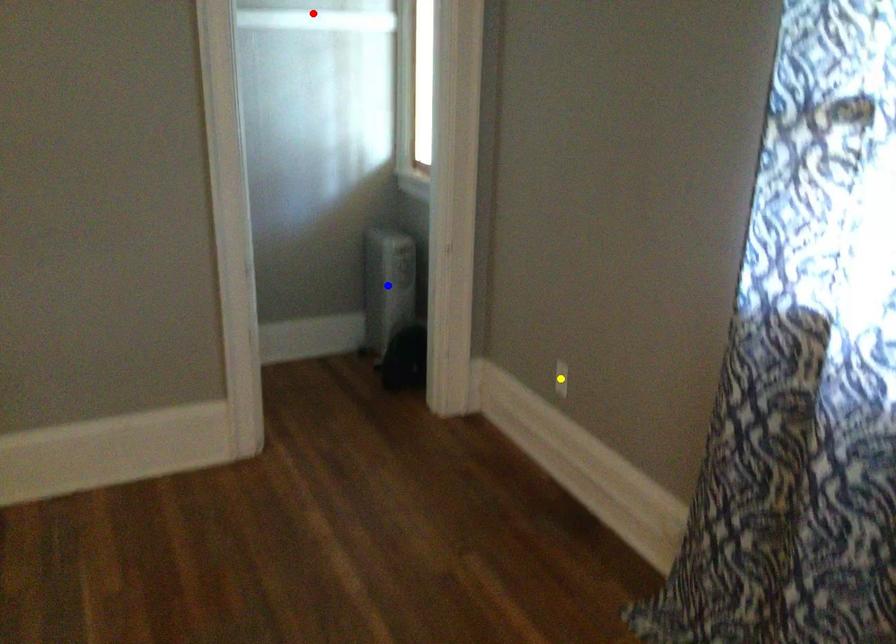
Order these from nearest to farthest:
yellow point, red point, blue point

yellow point, red point, blue point